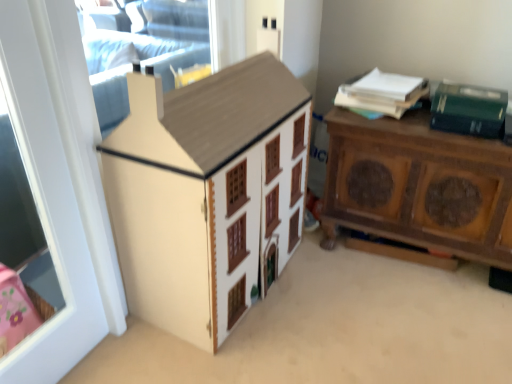
Question: From a real-world perspective, does brown wood nightstand at right sit lower than matte wood cabinet at center?

Choices:
 (A) yes
 (B) no

Answer: (A)

Question: Are brown wood nightstand at right and matte wood cabinet at center located far from each other?

Choices:
 (A) no
 (B) yes

Answer: (A)

Question: Does brown wood nightstand at right have a smaller size compared to matte wood cabinet at center?

Choices:
 (A) no
 (B) yes

Answer: (B)

Question: Is brown wood nightstand at right positioned in front of matte wood cabinet at center?

Choices:
 (A) yes
 (B) no

Answer: (B)

Question: Is brown wood nightstand at right positioned beyond the bounds of matte wood cabinet at center?

Choices:
 (A) no
 (B) yes

Answer: (B)

Question: Does brown wood nightstand at right appear on the left side of matte wood cabinet at center?

Choices:
 (A) no
 (B) yes

Answer: (A)

Question: Is brown wood nightstand at right positioned with its back to white glossy door at left?

Choices:
 (A) yes
 (B) no

Answer: (B)

Question: Is brown wood nightstand at right wider than white glossy door at left?

Choices:
 (A) yes
 (B) no

Answer: (A)

Question: From the image's perspective, is brown wood nightstand at right located beneath white glossy door at left?

Choices:
 (A) yes
 (B) no

Answer: (B)

Question: Can you confirm if brown wood nightstand at right is bigger than white glossy door at left?

Choices:
 (A) yes
 (B) no

Answer: (A)

Question: Can you confirm if brown wood nightstand at right is positioned to the right of white glossy door at left?

Choices:
 (A) yes
 (B) no

Answer: (A)

Question: From a real-world perspective, is brown wood nightstand at right under white glossy door at left?

Choices:
 (A) yes
 (B) no

Answer: (A)

Question: Is white paper at upper right outside of green matte box at upper right?

Choices:
 (A) no
 (B) yes

Answer: (B)